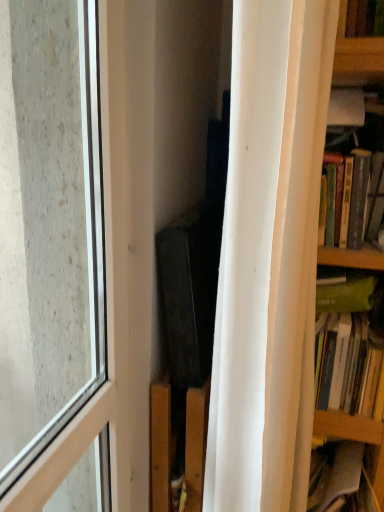
Question: Does hardcover books at right, the 2th book ordered from the bottom, have a greater width compared to white matte curtain at right?

Choices:
 (A) yes
 (B) no

Answer: (A)

Question: Is hardcover books at right, the 2th book ordered from the bottom, looking in the opposite direction of white matte curtain at right?

Choices:
 (A) yes
 (B) no

Answer: (B)

Question: Are hardcover books at right, acting as the first book starting from the top, and white matte curtain at right far apart?

Choices:
 (A) no
 (B) yes

Answer: (A)

Question: Is hardcover books at right, acting as the first book starting from the top, facing towards white matte curtain at right?

Choices:
 (A) yes
 (B) no

Answer: (A)

Question: From the image's perspective, is hardcover books at right, the 2th book ordered from the bottom, below white matte curtain at right?

Choices:
 (A) yes
 (B) no

Answer: (B)

Question: Considering their positions, is hardcover books at right, acting as the first book starting from the top, located in front of or behind transparent glass window at left?

Choices:
 (A) front
 (B) behind

Answer: (B)

Question: Choose the correct answer: Is hardcover books at right, the 2th book ordered from the bottom, inside transparent glass window at left or outside it?

Choices:
 (A) inside
 (B) outside

Answer: (B)

Question: Is hardcover books at right, acting as the first book starting from the top, to the left or to the right of transparent glass window at left in the image?

Choices:
 (A) right
 (B) left

Answer: (A)

Question: From the image's perspective, is hardcover books at right, acting as the first book starting from the top, above or below transparent glass window at left?

Choices:
 (A) above
 (B) below

Answer: (A)

Question: Visually, is hardcover books at right, acting as the first book starting from the top, positioned to the left or to the right of green matte book at right, arranged as the second book when viewed from the top?

Choices:
 (A) right
 (B) left

Answer: (B)

Question: From their relative heights in the image, would you say hardcover books at right, the 2th book ordered from the bottom, is taller or shorter than green matte book at right, arranged as the second book when viewed from the top?

Choices:
 (A) tall
 (B) short

Answer: (A)

Question: Is hardcover books at right, acting as the first book starting from the top, wider or thinner than green matte book at right, which appears as the 1th book when ordered from the bottom?

Choices:
 (A) wide
 (B) thin

Answer: (A)

Question: From a real-world perspective, is hardcover books at right, acting as the first book starting from the top, above or below green matte book at right, arranged as the second book when viewed from the top?

Choices:
 (A) above
 (B) below

Answer: (A)

Question: Looking at their shapes, would you say white matte curtain at right is wider or thinner than hardcover books at right, the 2th book ordered from the bottom?

Choices:
 (A) wide
 (B) thin

Answer: (B)

Question: From their relative heights in the image, would you say white matte curtain at right is taller or shorter than hardcover books at right, acting as the first book starting from the top?

Choices:
 (A) tall
 (B) short

Answer: (A)